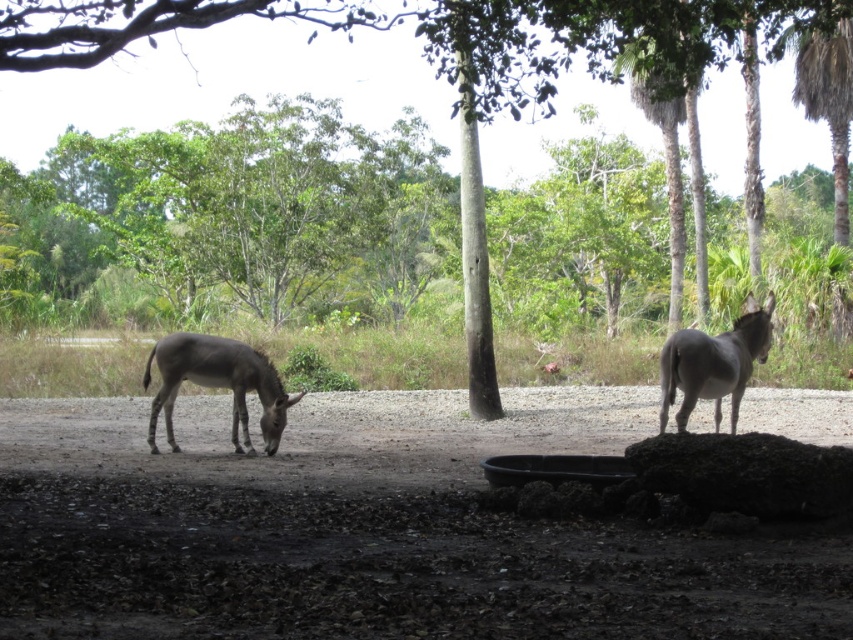
You are a photographer trying to capture a clear photo of the gray matte donkey at right. However, the dark brown dirt field at center is blocking your view. Can you move to the left or right to get a better angle?

The dark brown dirt field at center is in front of the gray matte donkey at right, so moving to the left or right might help you avoid the obstruction caused by the dirt field at center and get a clearer shot of the gray matte donkey at right.

You are a farmer checking the height of the donkeys to ensure they can reach the feeding trough. The trough is 1.2 meters tall. Which donkey, the gray matte donkey at left or the gray matte donkey at right, is more likely to reach the trough without difficulty?

The gray matte donkey at left is taller than the gray matte donkey at right, so the gray matte donkey at left is more likely to reach the trough without difficulty.